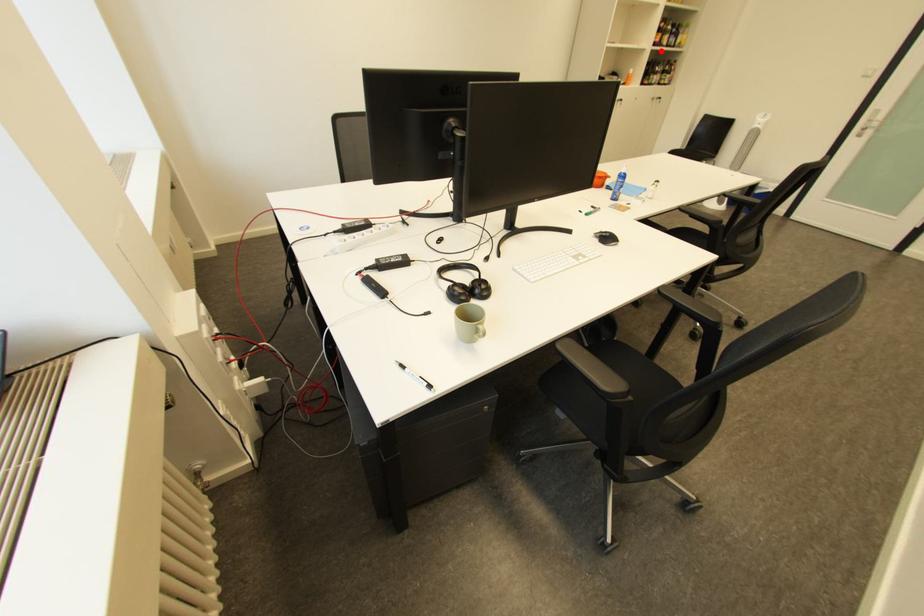
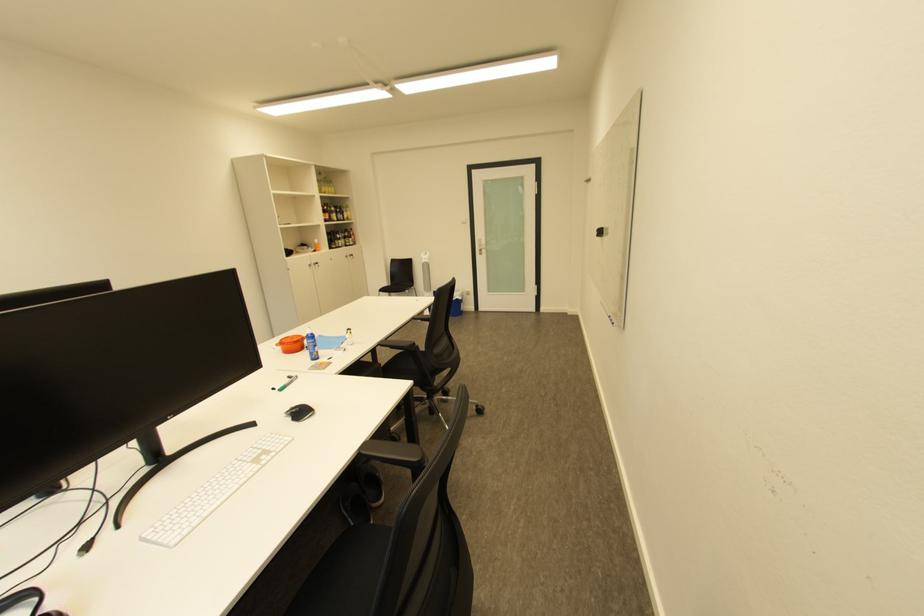
Question: A red point is marked in image1. In image2, is the corresponding 3D point closer to the camera or farther? Reply with the corresponding letter.

Choices:
 (A) The corresponding 3D point is closer.
 (B) The corresponding 3D point is farther.

Answer: (A)